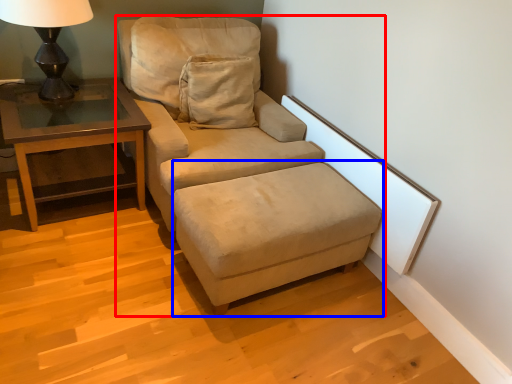
Question: Which of the following is the closest to the observer, studio couch (highlighted by a red box) or footrest (highlighted by a blue box)?

Choices:
 (A) studio couch
 (B) footrest

Answer: (B)